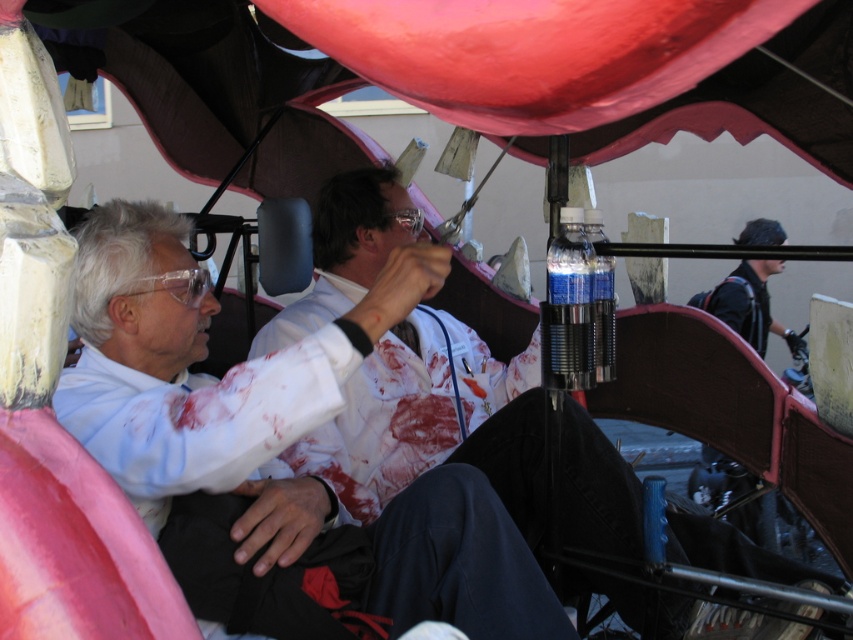
Question: Which object is farther from the camera taking this photo?

Choices:
 (A) dark blue fabric jacket at right
 (B) white matte lab coat at center
 (C) blood-stained lab coat at center

Answer: (A)

Question: Can you confirm if blood-stained lab coat at center is positioned above dark blue fabric jacket at right?

Choices:
 (A) yes
 (B) no

Answer: (A)

Question: Among these objects, which one is nearest to the camera?

Choices:
 (A) blood-stained lab coat at center
 (B) dark blue fabric jacket at right
 (C) white matte lab coat at center

Answer: (C)

Question: Is blood-stained lab coat at center thinner than dark blue fabric jacket at right?

Choices:
 (A) yes
 (B) no

Answer: (B)

Question: Which point is farther from the camera taking this photo?

Choices:
 (A) (706, 449)
 (B) (376, 188)
 (C) (126, 280)

Answer: (A)

Question: Observing the image, what is the correct spatial positioning of white matte lab coat at center in reference to blood-stained lab coat at center?

Choices:
 (A) below
 (B) above

Answer: (A)